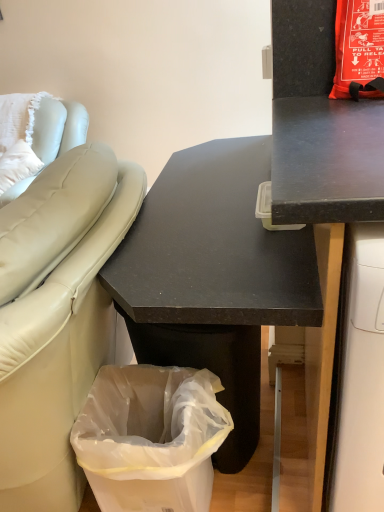
You are a GUI agent. You are given a task and a screenshot of the screen. Output one action in this format:
    pyautogui.click(x=<x>, y=<y>)
    Task: Click on the black matte desk at center, positioned as the second desk in right-to-left order
    The height and width of the screenshot is (512, 384).
    Given the screenshot: What is the action you would take?
    pyautogui.click(x=213, y=277)

The image size is (384, 512). What do you see at coordinates (74, 126) in the screenshot?
I see `white leather couch at left` at bounding box center [74, 126].

You are a GUI agent. You are given a task and a screenshot of the screen. Output one action in this format:
    pyautogui.click(x=<x>, y=<y>)
    Task: Click on the white leather couch at left
    
    Given the screenshot: What is the action you would take?
    pyautogui.click(x=74, y=126)

What is the approximate height of transparent plastic bag at lower left?

It is 18.90 inches.

Image resolution: width=384 pixels, height=512 pixels. Find the location of `black matte desk at center, positioned as the second desk in right-to-left order`. black matte desk at center, positioned as the second desk in right-to-left order is located at coordinates (213, 277).

Could you tell me if black matte desk at center, which appears as the first desk when viewed from the left, is facing transparent plastic bag at lower left?

Yes, black matte desk at center, which appears as the first desk when viewed from the left, is aimed at transparent plastic bag at lower left.

Considering the positions of objects black matte desk at center, positioned as the second desk in right-to-left order, and transparent plastic bag at lower left in the image provided, who is more to the left, black matte desk at center, positioned as the second desk in right-to-left order, or transparent plastic bag at lower left?

Positioned to the left is transparent plastic bag at lower left.

Looking at this image, from a real-world perspective, which object stands above the other?

black matte desk at center, which appears as the first desk when viewed from the left, from a real-world perspective.

Which object is further away from the camera taking this photo, black matte desk at center, positioned as the second desk in right-to-left order, or transparent plastic bag at lower left?

transparent plastic bag at lower left is behind.

From the image's perspective, between white leather couch at left and black matte desk at upper right, the second desk when ordered from left to right, who is located below?

black matte desk at upper right, the second desk when ordered from left to right, from the image's perspective.

Does white leather couch at left have a lesser width compared to black matte desk at upper right, the second desk when ordered from left to right?

Yes, white leather couch at left is thinner than black matte desk at upper right, the second desk when ordered from left to right.

Is white leather couch at left oriented away from black matte desk at upper right, the second desk when ordered from left to right?

white leather couch at left is not turned away from black matte desk at upper right, the second desk when ordered from left to right.

How many degrees apart are the facing directions of white leather couch at left and black matte desk at upper right, the first desk positioned from the right?

The angular difference between white leather couch at left and black matte desk at upper right, the first desk positioned from the right, is 0.32 degrees.

In the scene shown: Considering the relative sizes of white leather couch at left and black matte desk at center, which appears as the first desk when viewed from the left, in the image provided, is white leather couch at left wider than black matte desk at center, which appears as the first desk when viewed from the left,?

Yes.

From the picture: From the image's perspective, which is above, white leather couch at left or black matte desk at center, positioned as the second desk in right-to-left order?

white leather couch at left appears higher in the image.

Is white leather couch at left bigger than black matte desk at center, positioned as the second desk in right-to-left order?

Actually, white leather couch at left might be smaller than black matte desk at center, positioned as the second desk in right-to-left order.

Relative to black matte desk at center, which appears as the first desk when viewed from the left, is white leather couch at left in front or behind?

white leather couch at left is behind black matte desk at center, which appears as the first desk when viewed from the left.

From a real-world perspective, is black matte desk at upper right, the second desk when ordered from left to right, positioned above or below transparent plastic bag at lower left?

From a real-world perspective, black matte desk at upper right, the second desk when ordered from left to right, is physically above transparent plastic bag at lower left.

Is point (325, 136) positioned after point (186, 409)?

That is False.

In the image, is black matte desk at upper right, the second desk when ordered from left to right, on the left side or the right side of transparent plastic bag at lower left?

From the image, it's evident that black matte desk at upper right, the second desk when ordered from left to right, is to the right of transparent plastic bag at lower left.

Measure the distance from black matte desk at upper right, the second desk when ordered from left to right, to white leather couch at left.

They are 6.34 feet apart.

Considering the relative sizes of black matte desk at upper right, the second desk when ordered from left to right, and white leather couch at left in the image provided, is black matte desk at upper right, the second desk when ordered from left to right, thinner than white leather couch at left?

No, black matte desk at upper right, the second desk when ordered from left to right, is not thinner than white leather couch at left.

From a real-world perspective, is black matte desk at upper right, the first desk positioned from the right, above or below white leather couch at left?

black matte desk at upper right, the first desk positioned from the right, is below white leather couch at left.

Could you tell me if black matte desk at upper right, the first desk positioned from the right, is turned towards white leather couch at left?

No.

From the image's perspective, between transparent plastic bag at lower left and black matte desk at center, which appears as the first desk when viewed from the left, which one is located above?

black matte desk at center, which appears as the first desk when viewed from the left.

Is transparent plastic bag at lower left completely or partially outside of black matte desk at center, positioned as the second desk in right-to-left order?

No, transparent plastic bag at lower left is not entirely external to black matte desk at center, positioned as the second desk in right-to-left order.

Between transparent plastic bag at lower left and black matte desk at center, which appears as the first desk when viewed from the left, which one has smaller width?

transparent plastic bag at lower left.

How many degrees apart are the facing directions of transparent plastic bag at lower left and black matte desk at center, positioned as the second desk in right-to-left order?

There is a 0.000378-degree angle between the facing directions of transparent plastic bag at lower left and black matte desk at center, positioned as the second desk in right-to-left order.

Based on the photo, from a real-world perspective, which object rests below the other?

transparent plastic bag at lower left is physically lower.

Is white leather couch at left positioned with its back to transparent plastic bag at lower left?

No, white leather couch at left is not facing away from transparent plastic bag at lower left.

From the image's perspective, is white leather couch at left under transparent plastic bag at lower left?

No, from the image's perspective, white leather couch at left is not below transparent plastic bag at lower left.

This screenshot has height=512, width=384. I want to click on furniture on the left of the transparent plastic bag at lower left, so click(74, 126).

Where is `plastic bag directly beneath the black matte desk at center, positioned as the second desk in right-to-left order (from a real-world perspective)`? Image resolution: width=384 pixels, height=512 pixels. plastic bag directly beneath the black matte desk at center, positioned as the second desk in right-to-left order (from a real-world perspective) is located at coordinates (150, 438).

The height and width of the screenshot is (512, 384). Identify the location of the 1st desk below the white leather couch at left (from the image's perspective). (325, 219).

From the image, which object appears to be farther from transparent plastic bag at lower left, black matte desk at center, positioned as the second desk in right-to-left order, or white leather couch at left?

white leather couch at left is further to transparent plastic bag at lower left.

Based on their spatial positions, is black matte desk at center, positioned as the second desk in right-to-left order, or white leather couch at left closer to black matte desk at upper right, the first desk positioned from the right?

Among the two, black matte desk at center, positioned as the second desk in right-to-left order, is located nearer to black matte desk at upper right, the first desk positioned from the right.

Considering their positions, is black matte desk at center, positioned as the second desk in right-to-left order, positioned closer to black matte desk at upper right, the first desk positioned from the right, than transparent plastic bag at lower left?

black matte desk at center, positioned as the second desk in right-to-left order.

When comparing their distances from black matte desk at center, positioned as the second desk in right-to-left order, does black matte desk at upper right, the first desk positioned from the right, or white leather couch at left seem further?

Based on the image, white leather couch at left appears to be further to black matte desk at center, positioned as the second desk in right-to-left order.

From the image, which object appears to be nearer to white leather couch at left, black matte desk at center, which appears as the first desk when viewed from the left, or black matte desk at upper right, the second desk when ordered from left to right?

black matte desk at center, which appears as the first desk when viewed from the left, is positioned closer to the anchor white leather couch at left.

Estimate the real-world distances between objects in this image. Which object is closer to white leather couch at left, black matte desk at center, which appears as the first desk when viewed from the left, or transparent plastic bag at lower left?

Based on the image, black matte desk at center, which appears as the first desk when viewed from the left, appears to be nearer to white leather couch at left.

Based on their spatial positions, is black matte desk at upper right, the first desk positioned from the right, or black matte desk at center, which appears as the first desk when viewed from the left, further from transparent plastic bag at lower left?

The object further to transparent plastic bag at lower left is black matte desk at upper right, the first desk positioned from the right.

Looking at the image, which one is located closer to white leather couch at left, transparent plastic bag at lower left or black matte desk at center, which appears as the first desk when viewed from the left?

black matte desk at center, which appears as the first desk when viewed from the left, lies closer to white leather couch at left than the other object.

You are a GUI agent. You are given a task and a screenshot of the screen. Output one action in this format:
    pyautogui.click(x=<x>, y=<y>)
    Task: Click on the plastic bag between black matte desk at center, positioned as the second desk in right-to-left order, and white leather couch at left from front to back
    
    Given the screenshot: What is the action you would take?
    pyautogui.click(x=150, y=438)

This screenshot has width=384, height=512. What are the coordinates of `desk situated between transparent plastic bag at lower left and black matte desk at upper right, the second desk when ordered from left to right, from left to right` in the screenshot? It's located at (213, 277).

The height and width of the screenshot is (512, 384). I want to click on desk located between black matte desk at upper right, the first desk positioned from the right, and white leather couch at left in the depth direction, so click(213, 277).

You are a GUI agent. You are given a task and a screenshot of the screen. Output one action in this format:
    pyautogui.click(x=<x>, y=<y>)
    Task: Click on the plastic bag between black matte desk at upper right, the second desk when ordered from left to right, and white leather couch at left from front to back
    
    Given the screenshot: What is the action you would take?
    pyautogui.click(x=150, y=438)